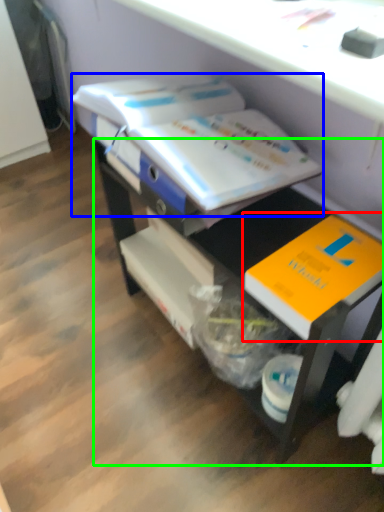
Question: Which object is the farthest from book (highlighted by a red box)? Choose among these: book (highlighted by a blue box) or desk (highlighted by a green box).

Choices:
 (A) book
 (B) desk

Answer: (A)